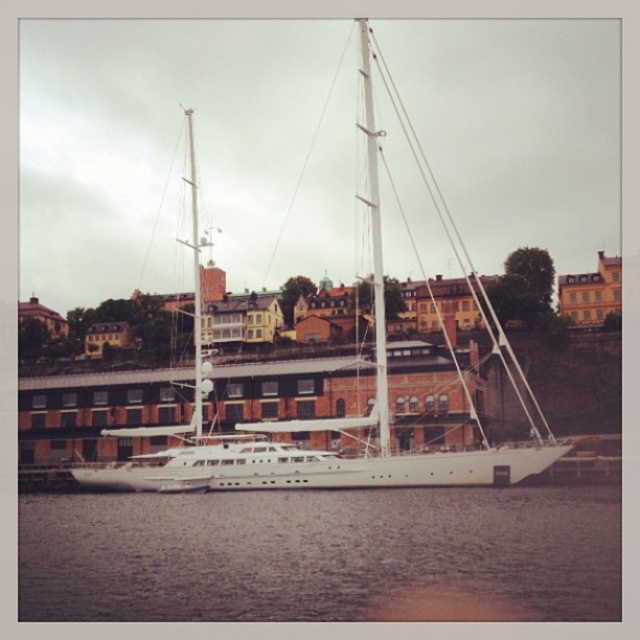
Question: Which object is closer to the camera taking this photo?

Choices:
 (A) clear water at lower center
 (B) white glossy sailboat at center

Answer: (A)

Question: Is clear water at lower center wider than white glossy sailboat at center?

Choices:
 (A) no
 (B) yes

Answer: (A)

Question: Does clear water at lower center lie in front of white glossy sailboat at center?

Choices:
 (A) no
 (B) yes

Answer: (B)

Question: In this image, where is clear water at lower center located relative to white glossy sailboat at center?

Choices:
 (A) above
 (B) below

Answer: (B)

Question: Among these objects, which one is nearest to the camera?

Choices:
 (A) white glossy sailboat at center
 (B) clear water at lower center

Answer: (B)